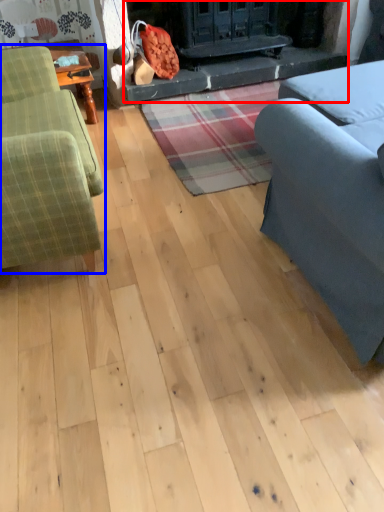
Question: Among these objects, which one is nearest to the camera, fireplace (highlighted by a red box) or studio couch (highlighted by a blue box)?

Choices:
 (A) fireplace
 (B) studio couch

Answer: (B)